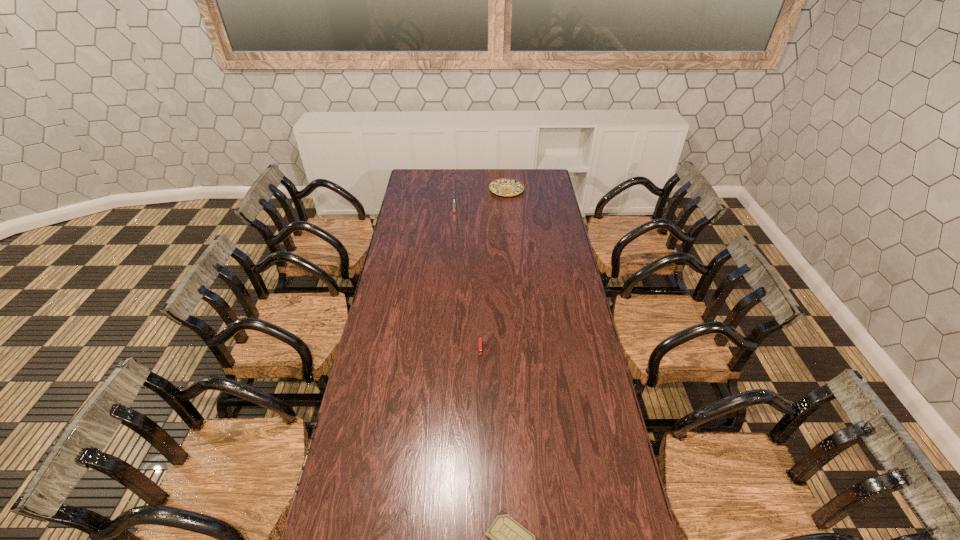
Locate an element on the screen. the taller stapler is located at coordinates (454, 200).

Where is `the tallest object`? the tallest object is located at coordinates (454, 200).

Locate an element on the screen. The width and height of the screenshot is (960, 540). the right stapler is located at coordinates (480, 338).

I want to click on the third farthest object, so click(x=480, y=338).

This screenshot has height=540, width=960. Find the location of `the farthest object`. the farthest object is located at coordinates (504, 186).

Locate an element on the screen. the third tallest object is located at coordinates (504, 186).

This screenshot has height=540, width=960. I want to click on vacant space located on the handle side of the taller stapler, so click(x=451, y=249).

You are a GUI agent. You are given a task and a screenshot of the screen. Output one action in this format:
    pyautogui.click(x=<x>, y=<y>)
    Task: Click on the free space located 0.060m on the front-facing side of the second tallest object
    The height and width of the screenshot is (540, 960).
    Given the screenshot: What is the action you would take?
    pyautogui.click(x=480, y=368)

Image resolution: width=960 pixels, height=540 pixels. In order to click on vacant space located on the left of the plate in this screenshot , I will do `click(463, 190)`.

At what (x,y) coordinates should I click in order to perform the action: click on object located at the far edge. Please return your answer as a coordinate pair (x, y). This screenshot has height=540, width=960. Looking at the image, I should click on (504, 186).